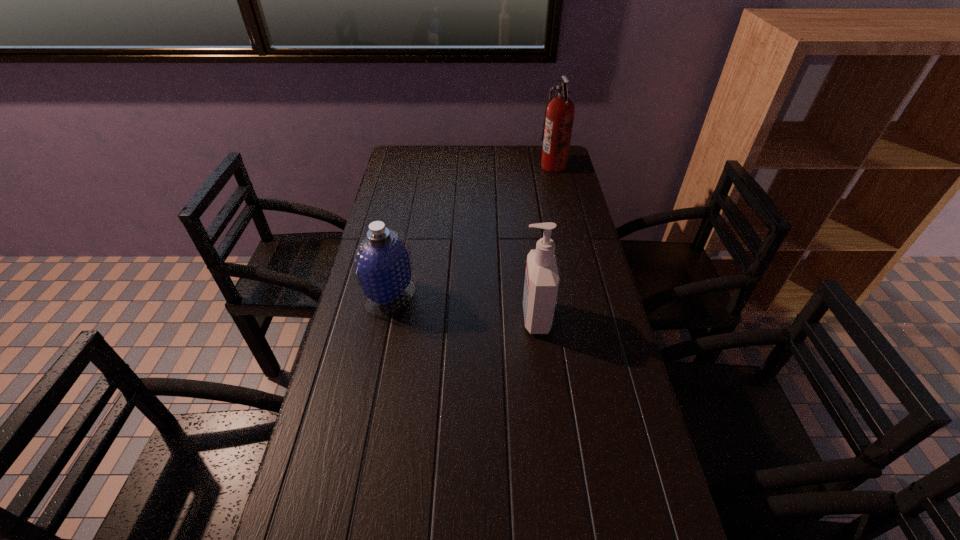
In order to click on vacant region located 0.350m on the front label of the second object from left to right in this screenshot , I will do `click(395, 318)`.

This screenshot has height=540, width=960. What are the coordinates of `free location located on the front label of the second object from left to right` in the screenshot? It's located at (502, 318).

This screenshot has height=540, width=960. I want to click on vacant space positioned on the right of the left cleansing agent, so click(536, 296).

This screenshot has width=960, height=540. What are the coordinates of `object located at the far edge` in the screenshot? It's located at (559, 115).

The height and width of the screenshot is (540, 960). Identify the location of object located in the left edge section of the desktop. (383, 264).

Identify the location of object situated at the right edge. (559, 115).

Identify the location of object situated at the far right corner. (559, 115).

In the image, there is a desktop. Identify the location of blank space at the far edge. (465, 167).

This screenshot has width=960, height=540. In order to click on free spot at the left edge of the desktop in this screenshot , I will do `click(411, 181)`.

The width and height of the screenshot is (960, 540). In the image, there is a desktop. Identify the location of vacant space at the right edge. (555, 178).